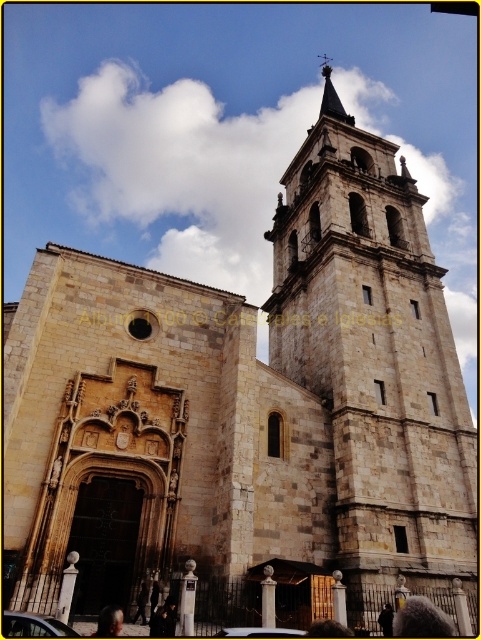
You are a tourist standing in front of the historic stone church and want to take a photo of the stone tower at center. To ensure the tower is centered in your photo, where should you position yourself relative to the church?

The stone tower at center is located at point (374, 358), so you should position yourself directly in front of the tower to ensure it is centered in your photo.

You are a maintenance worker tasked with inspecting the stone tower at center and the smooth gray stone spire at upper center. You have a ladder that can reach up to 30 meters. Can you safely reach both structures with your current ladder?

The distance between the stone tower at center and the smooth gray stone spire at upper center is 35.99 meters. Since your ladder only reaches up to 30 meters, you cannot safely reach both structures with your current ladder.

You are a visitor approaching the historic stone church. You notice the stone tower at center and the smooth gray stone spire at upper center. Which structure has a greater width?

The stone tower at center is wider than the smooth gray stone spire at upper center according to the description.